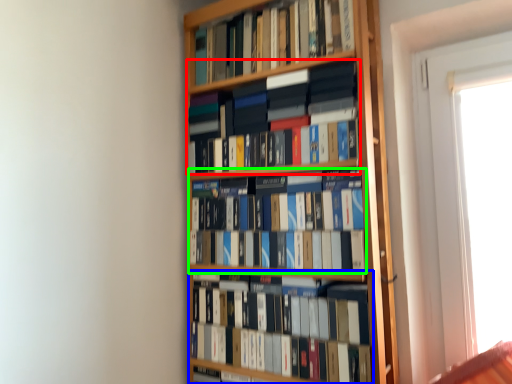
Question: Which object is the closest to the book (highlighted by a red box)? Choose among these: book (highlighted by a blue box) or book (highlighted by a green box).

Choices:
 (A) book
 (B) book

Answer: (B)